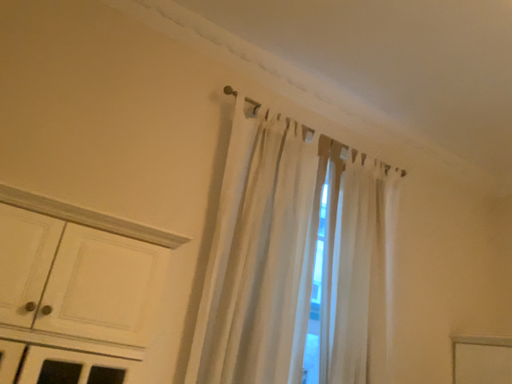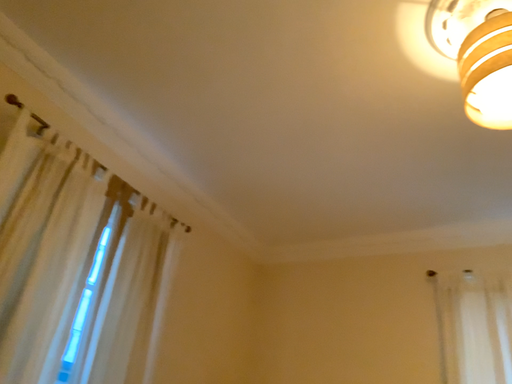
Question: How did the camera likely rotate when shooting the video?

Choices:
 (A) rotated left
 (B) rotated right

Answer: (B)